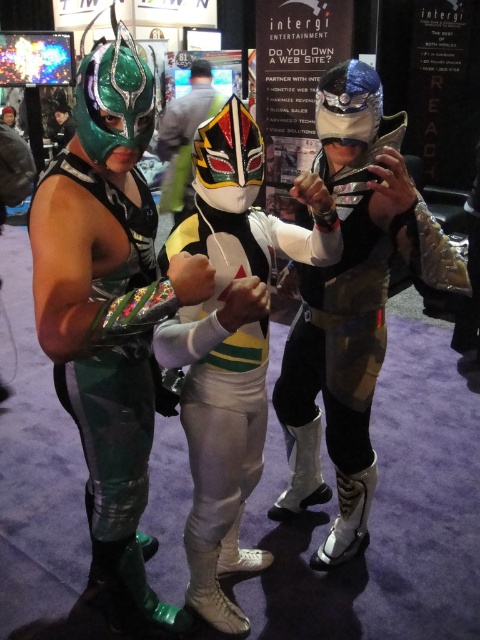
You are a photographer at a wrestling event. You need to capture a photo of the shiny silver armor at center and the green shiny suit at left. According to the scene, which one is positioned to the right of the other?

The shiny silver armor at center is positioned on the right side of green shiny suit at left.

You are a photographer at the event and want to capture the central figure in a way that both the white matte costume at center and the white glossy mask at center are clearly visible. Given their positions, which part should you focus on to ensure both are in sharp focus?

The white matte costume at center is located below the white glossy mask at center. To ensure both are in sharp focus, focus on the white glossy mask at center since it is higher up, and adjust the camera settings to have a sufficient depth of field to capture the costume below as well.